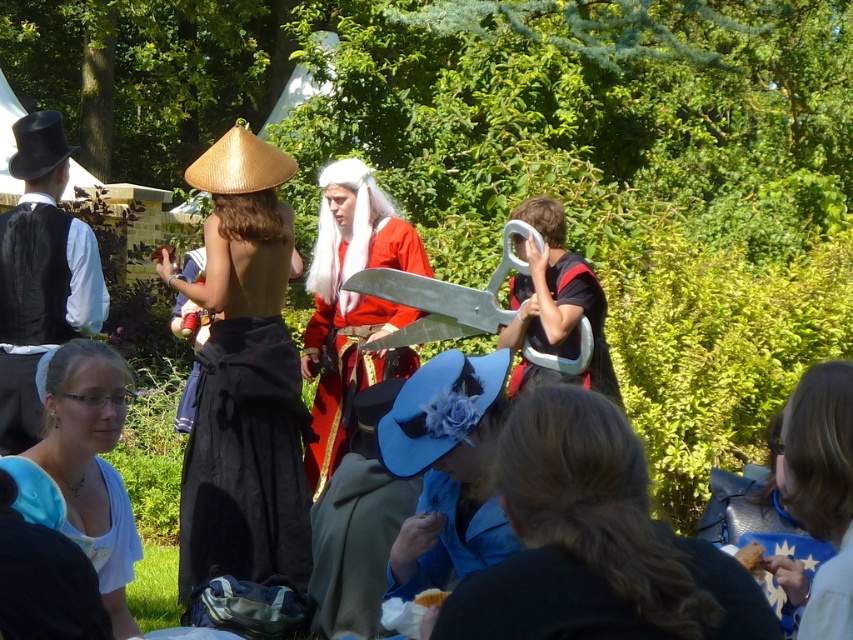
Looking at this image, you are organizing a photo shoot in this scene and need to position two props, the bamboo hat at center and the red velvet dress at center, so that they are closer together for a better composition. Given their current distance, how much closer do you need to move them?

The bamboo hat at center and red velvet dress at center are currently 3.36 feet apart. To bring them closer together, you would need to reduce the distance between them by 3.36 feet to achieve the desired composition.

You are a photographer trying to capture a photo of the bamboo hat at center and the red velvet dress at center. Which object should you focus on first to ensure both are in clear view?

The bamboo hat at center is closer to the viewer than the red velvet dress at center, so you should focus on the bamboo hat at center first to ensure both are in clear view.